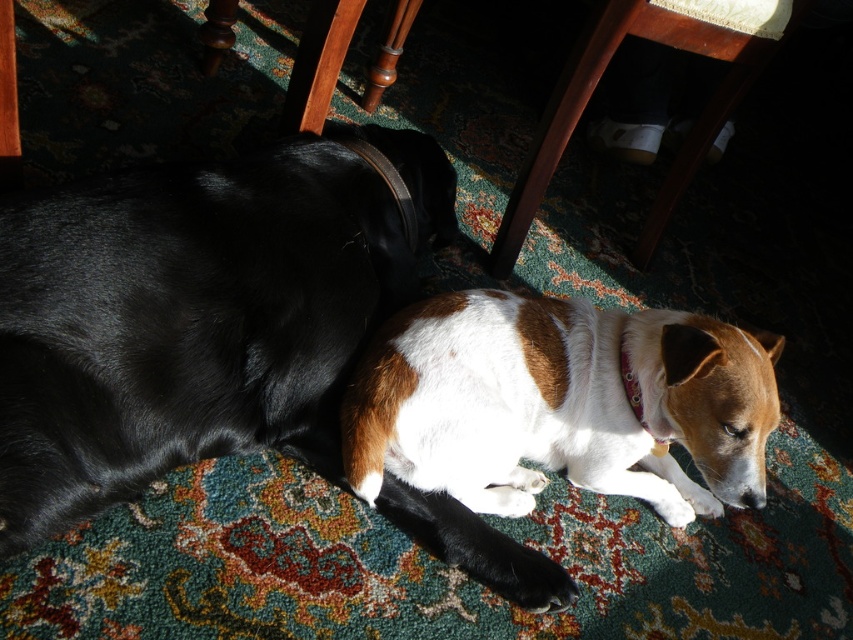
Is brown/white fur dog at lower right smaller than pink fabric neckband at lower center?

Actually, brown/white fur dog at lower right might be larger than pink fabric neckband at lower center.

Does brown/white fur dog at lower right have a larger size compared to pink fabric neckband at lower center?

Yes, brown/white fur dog at lower right is bigger than pink fabric neckband at lower center.

Locate an element on the screen. The width and height of the screenshot is (853, 640). brown/white fur dog at lower right is located at coordinates (196, 314).

Locate an element on the screen. This screenshot has width=853, height=640. brown/white fur dog at lower right is located at coordinates (196, 314).

Is brown/white fur dog at center to the left of leather at center from the viewer's perspective?

In fact, brown/white fur dog at center is to the right of leather at center.

Where is `brown/white fur dog at center`? The image size is (853, 640). brown/white fur dog at center is located at coordinates (560, 403).

Can you confirm if brown/white fur dog at center is shorter than wooden chair leg at lower center?

Correct, brown/white fur dog at center is not as tall as wooden chair leg at lower center.

Who is taller, brown/white fur dog at center or wooden chair leg at lower center?

Standing taller between the two is wooden chair leg at lower center.

Where is `brown/white fur dog at center`? brown/white fur dog at center is located at coordinates (560, 403).